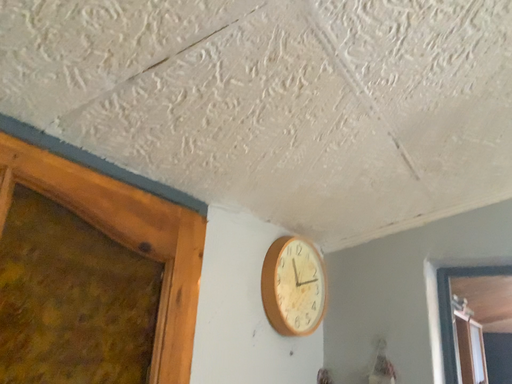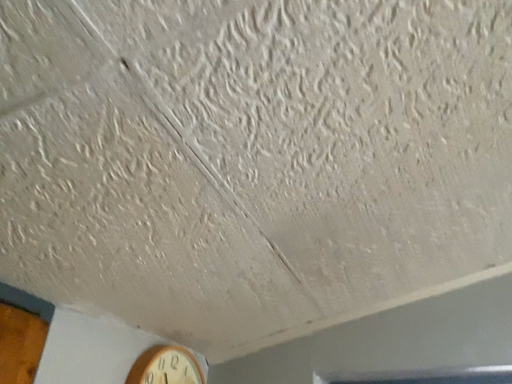
Question: How did the camera likely rotate when shooting the video?

Choices:
 (A) rotated left
 (B) rotated right

Answer: (B)